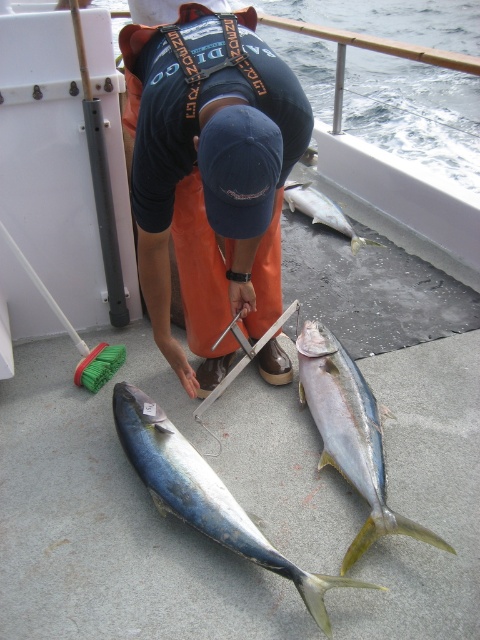
You are standing at the point marked as point [248,99] on the boat deck. You want to take a photo of the two yellowtail tuna fish using a camera that has a maximum focus distance of 1.2 meters. Will the camera be able to focus on the fish if you are at that point?

The distance between point [248,99] and the camera is 1.26 meters. Since the camera can only focus up to 1.2 meters, it will not be able to focus on the fish from that point.

You are a deckhand on the boat and need to secure the orange fabric at center and the shiny silver fish at center. Which object is located lower in position?

The orange fabric at center is located below the shiny silver fish at center, so it is lower in position.